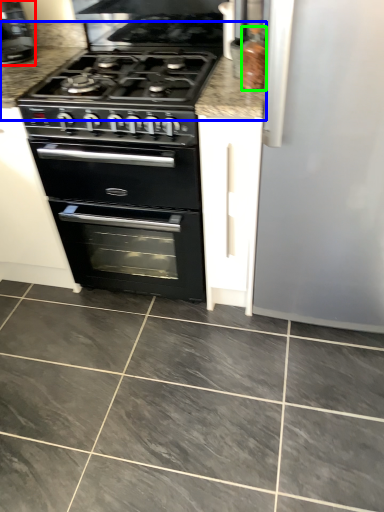
Question: Which is farther away from coffee machine (highlighted by a red box)? counter top (highlighted by a blue box) or appliance (highlighted by a green box)?

Choices:
 (A) counter top
 (B) appliance

Answer: (B)